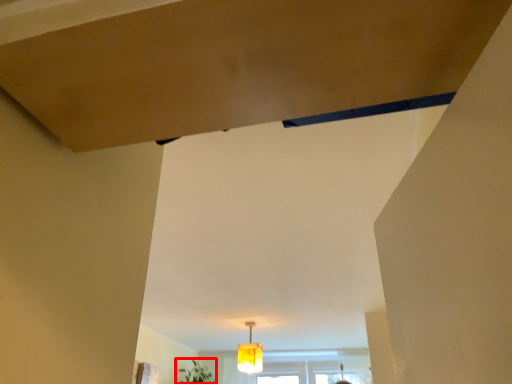
Question: From the image, what is the correct spatial relationship of plant (annotated by the red box) in relation to lamp?

Choices:
 (A) right
 (B) left

Answer: (B)